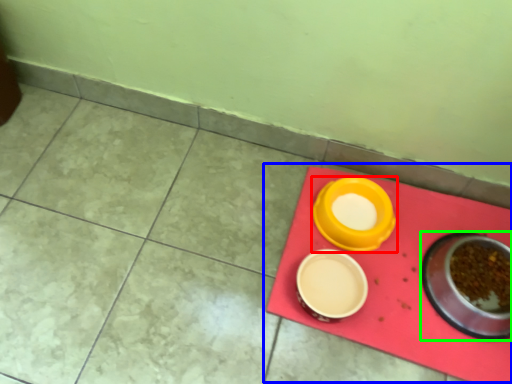
Question: Which object is the farthest from tableware (highlighted by a red box)? Choose among these: table (highlighted by a blue box) or tableware (highlighted by a green box).

Choices:
 (A) table
 (B) tableware

Answer: (B)